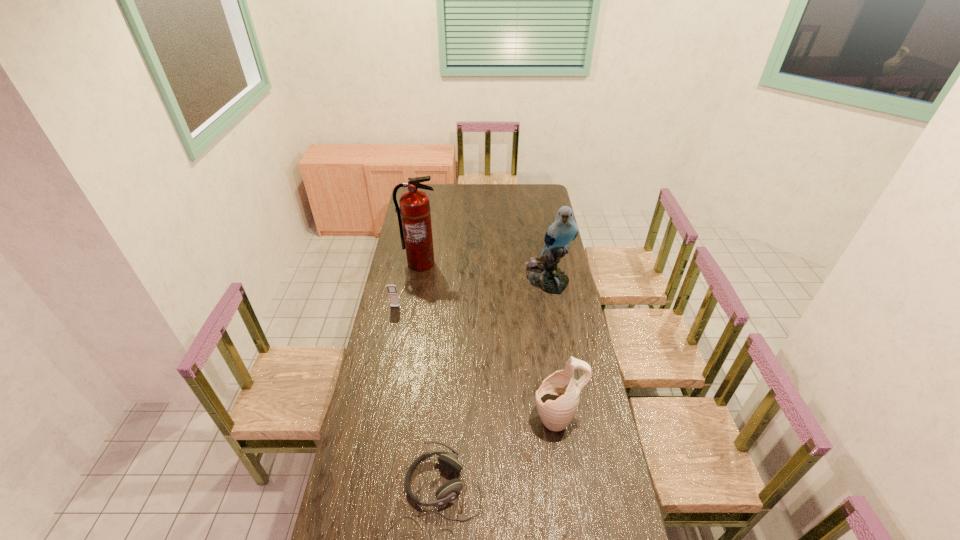
Where is `vacant space that is in between the pitcher and the third nearest object`? vacant space that is in between the pitcher and the third nearest object is located at coordinates (476, 363).

At what (x,y) coordinates should I click in order to perform the action: click on empty space between the parakeet and the fire extinguisher. Please return your answer as a coordinate pair (x, y). This screenshot has height=540, width=960. Looking at the image, I should click on (484, 271).

Locate an element on the screen. Image resolution: width=960 pixels, height=540 pixels. free area in between the parakeet and the third shortest object is located at coordinates (552, 349).

The width and height of the screenshot is (960, 540). Find the location of `unoccupied position between the pitcher and the third nearest object`. unoccupied position between the pitcher and the third nearest object is located at coordinates (476, 363).

The image size is (960, 540). What are the coordinates of `empty space between the fire extinguisher and the second nearest object` in the screenshot? It's located at (489, 341).

I want to click on vacant space that's between the third nearest object and the fourth farthest object, so click(476, 363).

Identify the location of free space between the parakeet and the cellular telephone. (471, 293).

Where is `object that stands as the closest to the cellular telephone`? object that stands as the closest to the cellular telephone is located at coordinates (414, 209).

The width and height of the screenshot is (960, 540). I want to click on the closest object to the fire extinguisher, so click(x=392, y=290).

Image resolution: width=960 pixels, height=540 pixels. What are the coordinates of `vacant region that satisfies the following two spatial constraints: 1. on the face of the parakeet; 2. at the spout of the pitcher` in the screenshot? It's located at (571, 418).